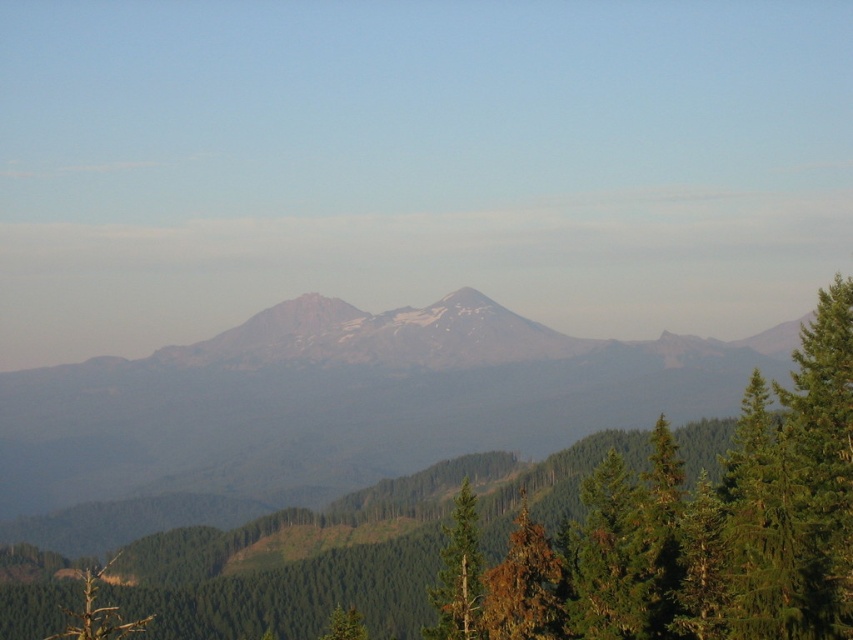
Does gray rocky mountain range at center have a greater height compared to green textured tree at lower left?

Indeed, gray rocky mountain range at center has a greater height compared to green textured tree at lower left.

This screenshot has height=640, width=853. I want to click on gray rocky mountain range at center, so click(x=329, y=408).

Identify the location of gray rocky mountain range at center. This screenshot has height=640, width=853. (329, 408).

Is gray rocky mountain range at center to the right of brown/dried wood tree at center from the viewer's perspective?

Incorrect, gray rocky mountain range at center is not on the right side of brown/dried wood tree at center.

The width and height of the screenshot is (853, 640). Describe the element at coordinates (329, 408) in the screenshot. I see `gray rocky mountain range at center` at that location.

Does point (235, 417) come in front of point (525, 520)?

No, it is not.

Identify the location of gray rocky mountain range at center. The width and height of the screenshot is (853, 640). (329, 408).

Which is behind, point (534, 556) or point (476, 550)?

The point (476, 550) is behind.

Does brown/dried wood tree at center lie in front of green matte tree at center?

Yes, it is.

Who is more distant from viewer, (514, 595) or (442, 628)?

Point (442, 628)

What are the coordinates of `brown/dried wood tree at center` in the screenshot? It's located at (524, 586).